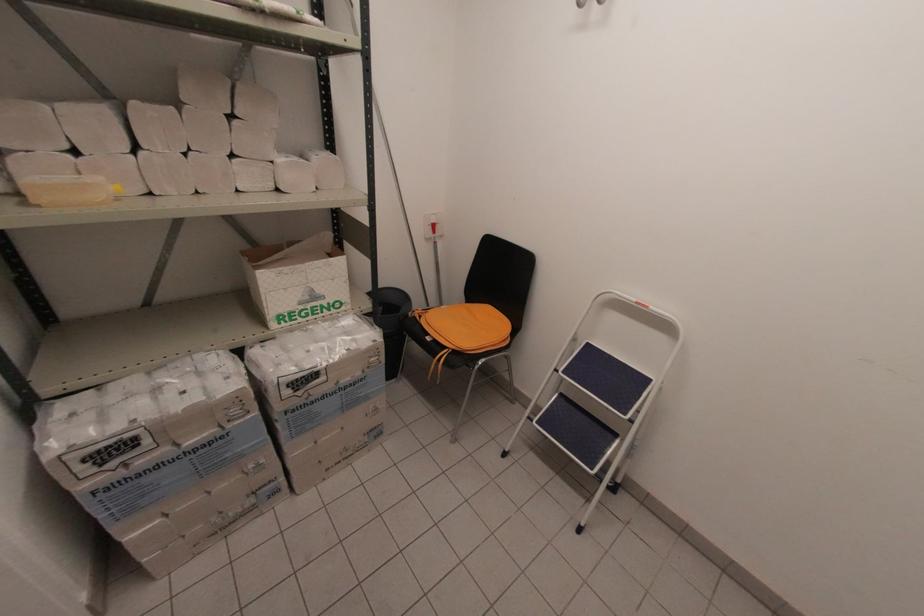
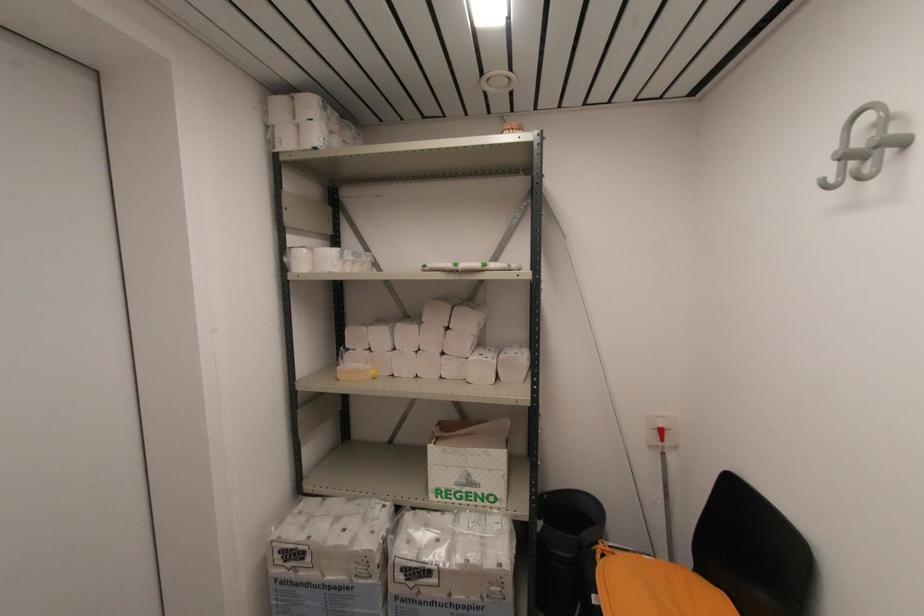
Where in the second image is the point corresponding to pixel 309 298 from the first image?

(465, 480)